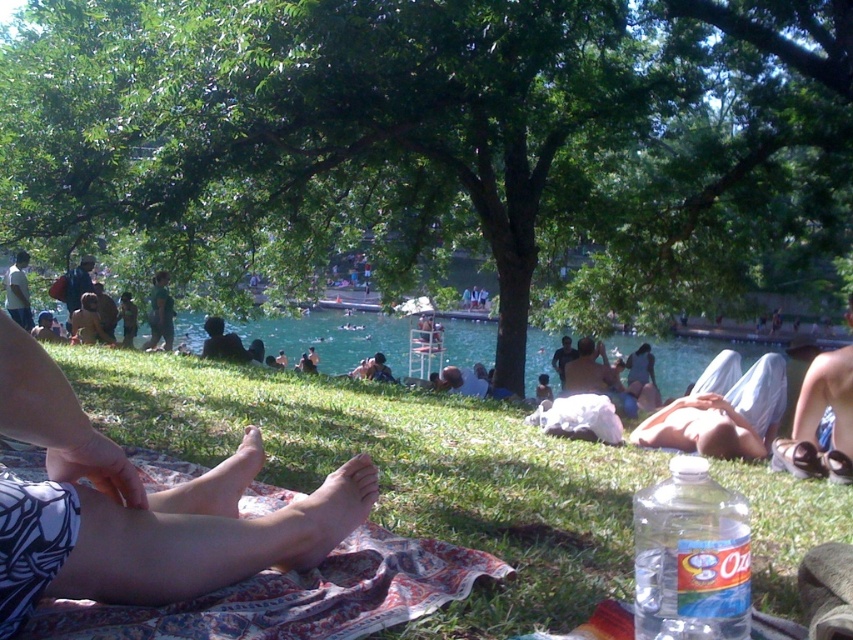
Is green leafy tree at center to the right of light beige cotton shorts at lower right from the viewer's perspective?

No, green leafy tree at center is not to the right of light beige cotton shorts at lower right.

Who is positioned more to the left, green leafy tree at center or light beige cotton shorts at lower right?

green leafy tree at center

Is point (303, 259) closer to camera compared to point (758, 403)?

No, (303, 259) is further to viewer.

Find the location of a particular element. green leafy tree at center is located at coordinates (438, 140).

Between point (206, 344) and point (103, 337), which one is positioned in front?

Positioned in front is point (206, 344).

Can you confirm if dark hair at center is wider than brown leather jacket at lower left?

Yes.

What are the coordinates of `dark hair at center` in the screenshot? It's located at (222, 342).

Which is in front, point (718, 438) or point (125, 321)?

Positioned in front is point (718, 438).

Is light beige cotton shorts at lower right positioned at the back of dark green shirt at center?

No, light beige cotton shorts at lower right is closer to the viewer.

Who is more forward, [759,406] or [119,307]?

Point [759,406] is in front.

Locate an element on the screen. light beige cotton shorts at lower right is located at coordinates (722, 410).